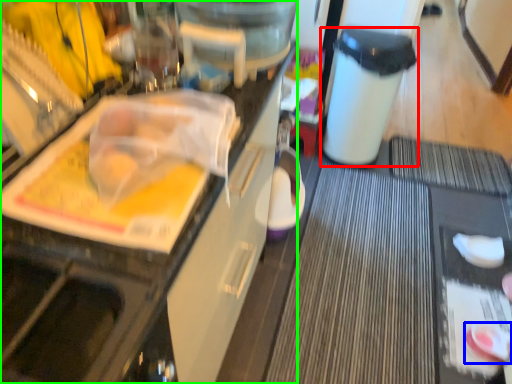
Question: Which is farther away from trash bin/can (highlighted by a red box)? food (highlighted by a blue box) or cabinetry (highlighted by a green box)?

Choices:
 (A) food
 (B) cabinetry

Answer: (B)